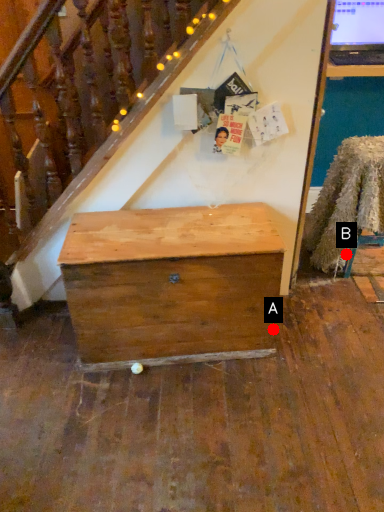
Question: Two points are circled on the image, labeled by A and B beside each circle. Which point is farther to the camera?

Choices:
 (A) A is further
 (B) B is further

Answer: (B)